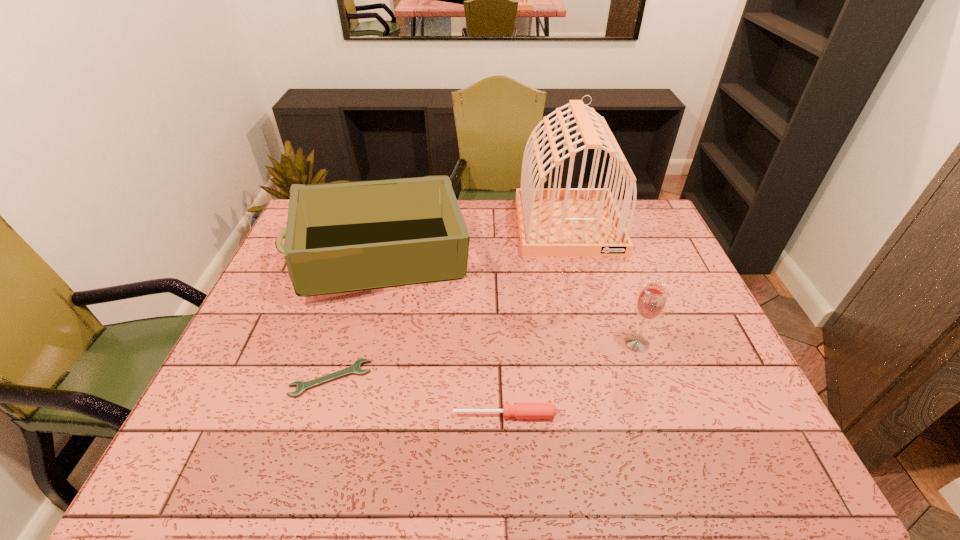
Image resolution: width=960 pixels, height=540 pixels. Identify the location of free space at the left edge. (280, 259).

In the image, there is a desktop. Identify the location of vacant space at the right edge. The image size is (960, 540). (659, 260).

Where is `vacant region between the box and the birdcage`? vacant region between the box and the birdcage is located at coordinates (475, 242).

Locate an element on the screen. The width and height of the screenshot is (960, 540). vacant point located between the third nearest object and the birdcage is located at coordinates (603, 284).

The height and width of the screenshot is (540, 960). In order to click on empty space between the wineglass and the box in this screenshot , I will do click(x=510, y=301).

Where is `vacant space that is in between the second nearest object and the box`? The width and height of the screenshot is (960, 540). vacant space that is in between the second nearest object and the box is located at coordinates (357, 319).

In order to click on free space between the second shortest object and the birdcage in this screenshot , I will do `click(537, 320)`.

I want to click on blank region between the nearest object and the third nearest object, so click(x=571, y=379).

This screenshot has width=960, height=540. In order to click on vacant point located between the shortest object and the third nearest object in this screenshot , I will do coord(484,361).

At what (x,y) coordinates should I click in order to perform the action: click on free spot between the nearest object and the fourth farthest object. Please return your answer as a coordinate pair (x, y). Looking at the image, I should click on (418, 396).